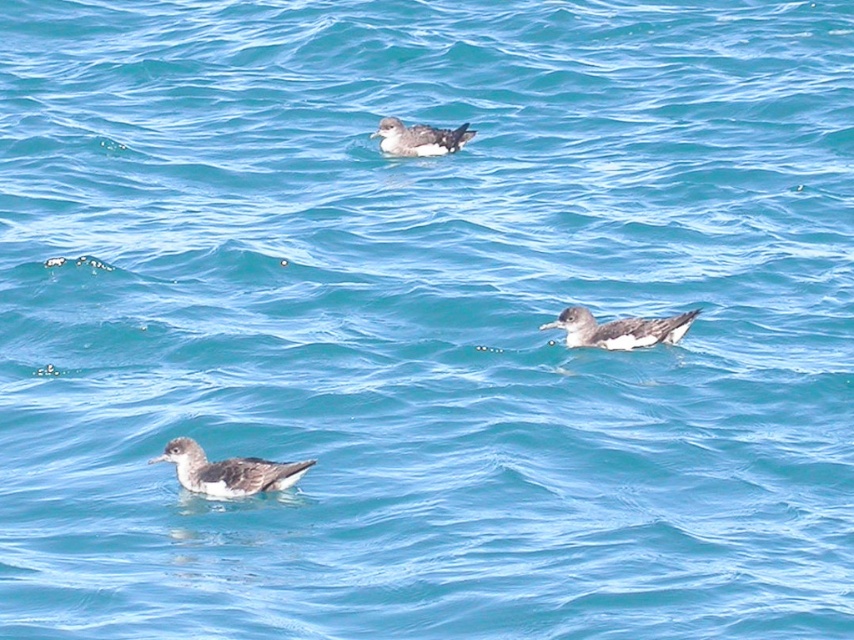
Question: Among these objects, which one is nearest to the camera?

Choices:
 (A) dark gray feathers at upper center
 (B) speckled gray bird at center

Answer: (B)

Question: Does speckled gray bird at center appear on the left side of dark gray speckled bird at center?

Choices:
 (A) yes
 (B) no

Answer: (A)

Question: Where is speckled gray bird at center located in relation to dark gray speckled bird at center in the image?

Choices:
 (A) left
 (B) right

Answer: (A)

Question: Based on their relative distances, which object is farther from the speckled gray bird at center?

Choices:
 (A) dark gray feathers at upper center
 (B) dark gray speckled bird at center

Answer: (A)

Question: Can you confirm if dark gray speckled bird at center is bigger than dark gray feathers at upper center?

Choices:
 (A) no
 (B) yes

Answer: (B)

Question: Which is farther from the dark gray speckled bird at center?

Choices:
 (A) dark gray feathers at upper center
 (B) speckled gray bird at center

Answer: (A)